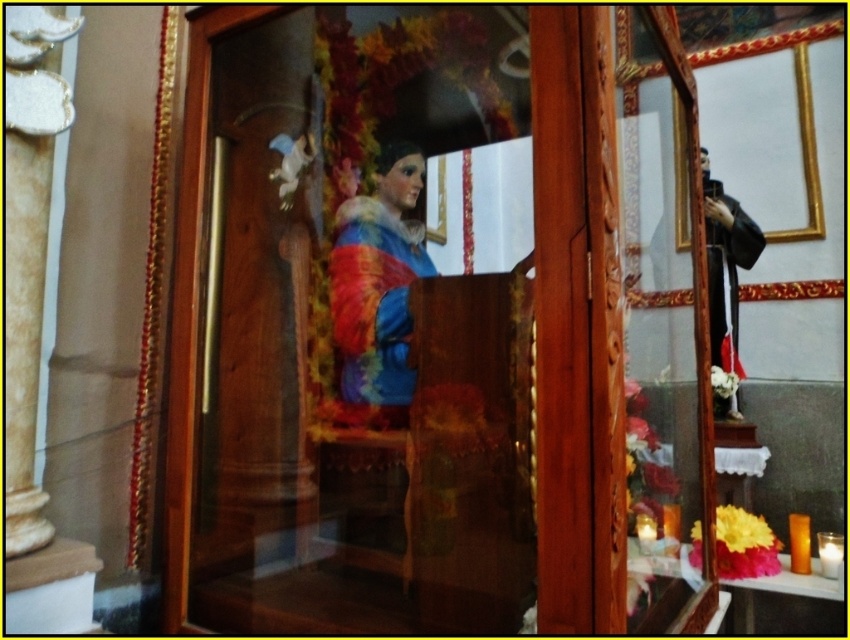
Is transparent glass statue at center positioned at the back of black matte robe at right?

No, transparent glass statue at center is closer to the viewer.

Does transparent glass statue at center have a smaller size compared to black matte robe at right?

Incorrect, transparent glass statue at center is not smaller in size than black matte robe at right.

Is point (438, 259) positioned after point (706, 202)?

Yes, it is behind point (706, 202).

Where is `transparent glass statue at center`? transparent glass statue at center is located at coordinates (350, 330).

Can you confirm if matte painted statue at center is positioned above black matte robe at right?

No.

The image size is (850, 640). What do you see at coordinates (378, 280) in the screenshot?
I see `matte painted statue at center` at bounding box center [378, 280].

Where is `matte painted statue at center`? The width and height of the screenshot is (850, 640). matte painted statue at center is located at coordinates (378, 280).

This screenshot has width=850, height=640. I want to click on matte painted statue at center, so click(x=378, y=280).

Who is positioned more to the right, transparent glass statue at center or matte painted statue at center?

transparent glass statue at center

Image resolution: width=850 pixels, height=640 pixels. Find the location of `transparent glass statue at center`. transparent glass statue at center is located at coordinates pos(350,330).